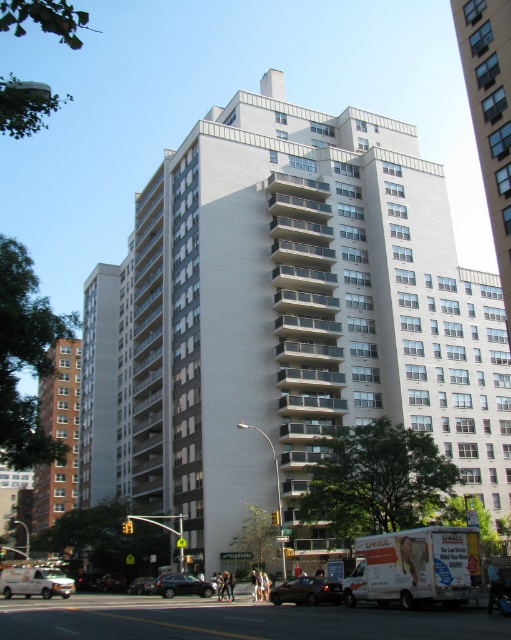
Question: Which point is closer to the camera?

Choices:
 (A) (293, 593)
 (B) (39, 588)
 (C) (354, 278)
 (D) (60, 403)

Answer: (A)

Question: Can you confirm if brown brick building at center is smaller than silver metallic sedan at center?

Choices:
 (A) yes
 (B) no

Answer: (B)

Question: Which point appears farthest from the camera in this image?

Choices:
 (A) (56, 472)
 (B) (287, 588)
 (C) (140, 579)
 (D) (109, 589)

Answer: (A)

Question: Does brown brick building at center lie behind shiny brown car at lower center?

Choices:
 (A) no
 (B) yes

Answer: (A)

Question: Which point is farther to the camera?

Choices:
 (A) (2, 579)
 (B) (270, 593)
 (C) (452, 356)

Answer: (C)

Question: Is brown brick building at center thinner than black glossy sedan at center?

Choices:
 (A) no
 (B) yes

Answer: (A)